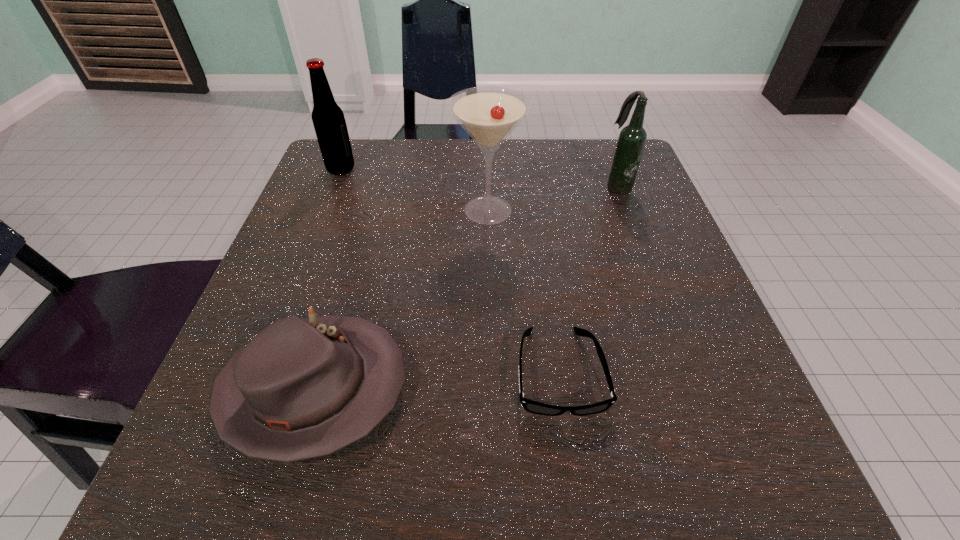
Locate an element on the screen. vacant space at the far edge of the desktop is located at coordinates (556, 162).

Locate an element on the screen. The height and width of the screenshot is (540, 960). free location at the left edge is located at coordinates pyautogui.click(x=278, y=274).

The height and width of the screenshot is (540, 960). Identify the location of vacant space at the right edge of the desktop. [x=655, y=321].

Where is `free space at the far left corner of the desktop`? Image resolution: width=960 pixels, height=540 pixels. free space at the far left corner of the desktop is located at coordinates (359, 156).

Where is `vacant area at the far right corner of the desktop`? The image size is (960, 540). vacant area at the far right corner of the desktop is located at coordinates (571, 153).

I want to click on free location at the near right corner of the desktop, so click(x=691, y=501).

Where is `blank region between the left beer bottle and the rightmost object`? The width and height of the screenshot is (960, 540). blank region between the left beer bottle and the rightmost object is located at coordinates [x=479, y=178].

Find the location of a particular element. blank region between the right beer bottle and the left beer bottle is located at coordinates (479, 178).

Locate an element on the screen. free spot between the rightmost object and the martini is located at coordinates (553, 199).

Locate an element on the screen. This screenshot has width=960, height=540. empty space between the left beer bottle and the sunglasses is located at coordinates coord(450,271).